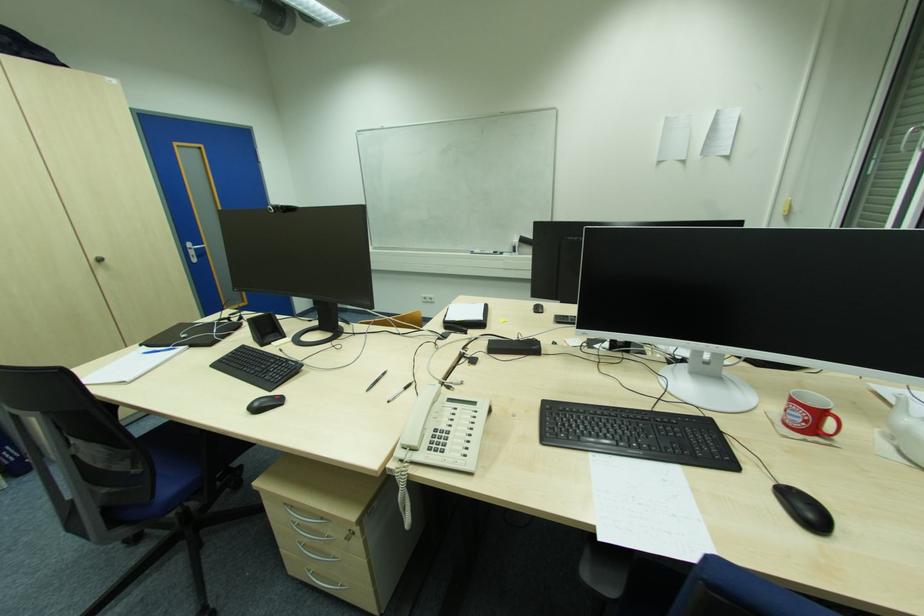
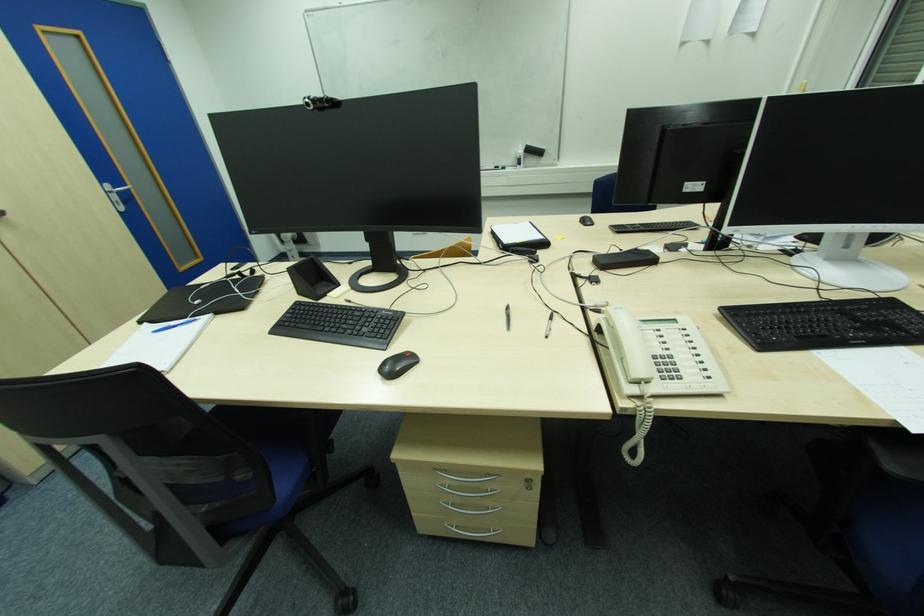
Locate, in the second image, the point that corresponds to the point at 386,375 in the first image.

(509, 309)